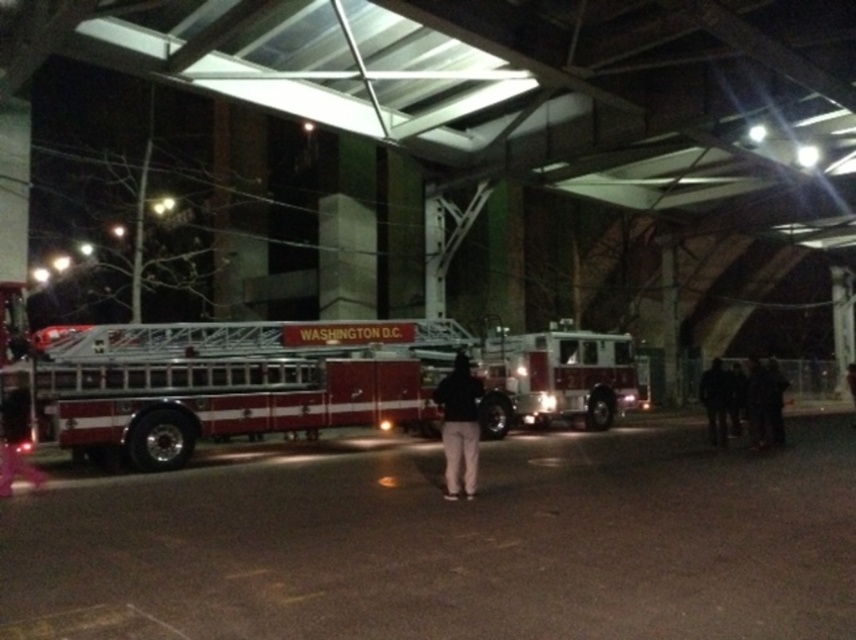
Question: Where is black matte pants at center located in relation to black fabric jacket at center in the image?

Choices:
 (A) below
 (B) above

Answer: (B)

Question: Based on their relative distances, which object is nearer to the black fabric jacket at lower right?

Choices:
 (A) black matte pants at center
 (B) red/white metallic fire truck at center
 (C) black fabric jacket at center
 (D) black fabric person at lower right

Answer: (D)

Question: Which point is closer to the camera?

Choices:
 (A) red/white metallic fire truck at center
 (B) black fabric jacket at center
 (C) black matte pants at center

Answer: (C)

Question: Can you confirm if black fabric person at lower right is thinner than black fabric jacket at center?

Choices:
 (A) no
 (B) yes

Answer: (B)

Question: Which point is closer to the camera taking this photo?

Choices:
 (A) (847, 376)
 (B) (450, 467)
 (C) (716, 396)
 (D) (526, 394)

Answer: (B)

Question: Is the position of black matte pants at center more distant than that of black fabric jacket at lower right?

Choices:
 (A) yes
 (B) no

Answer: (B)